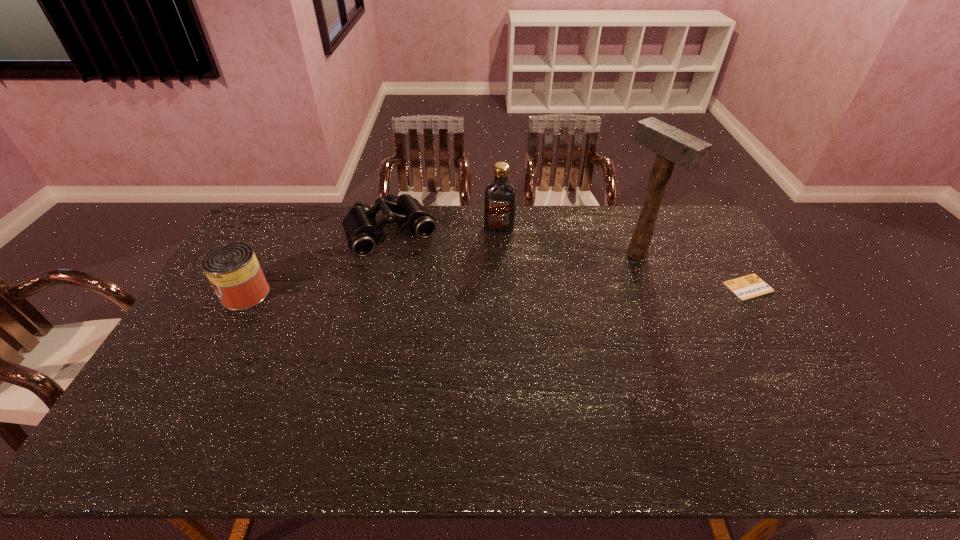
At what (x,y) coordinates should I click in order to perform the action: click on vacant point located on the front-facing side of the second object from left to right. Please return your answer as a coordinate pair (x, y). Image resolution: width=960 pixels, height=540 pixels. Looking at the image, I should click on (435, 302).

The height and width of the screenshot is (540, 960). What are the coordinates of `mallet that is positioned at the far edge` in the screenshot? It's located at (673, 146).

I want to click on vodka positioned at the far edge, so click(x=499, y=195).

The width and height of the screenshot is (960, 540). Identify the location of binoculars that is at the far edge. (363, 232).

In order to click on object at the left edge in this screenshot , I will do `click(233, 270)`.

Locate an element on the screen. object located at the right edge is located at coordinates point(750,286).

Locate an element on the screen. vacant space at the far edge of the desktop is located at coordinates (329, 214).

In the image, there is a desktop. Where is `vacant space at the near edge`? The image size is (960, 540). vacant space at the near edge is located at coordinates click(630, 412).

At what (x,y) coordinates should I click in order to perform the action: click on free region at the left edge. Please return your answer as a coordinate pair (x, y). The height and width of the screenshot is (540, 960). Looking at the image, I should click on (211, 360).

I want to click on vacant space at the right edge of the desktop, so click(x=796, y=367).